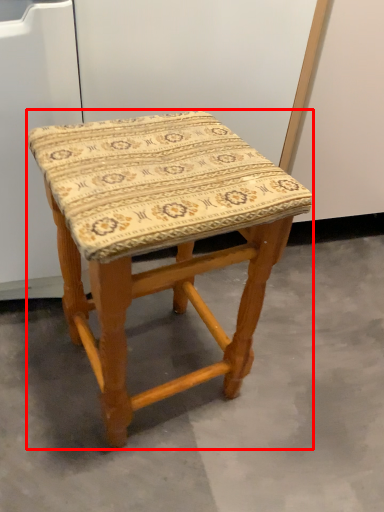
Question: From the image's perspective, what is the correct spatial positioning of stool (annotated by the red box) in reference to concrete?

Choices:
 (A) above
 (B) below

Answer: (A)